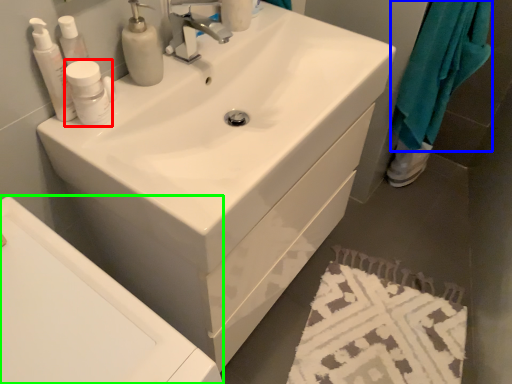
Question: Which object is the closest to the mouthwash (highlighted by a red box)? Choose among these: cloth (highlighted by a blue box) or bath (highlighted by a green box).

Choices:
 (A) cloth
 (B) bath

Answer: (B)